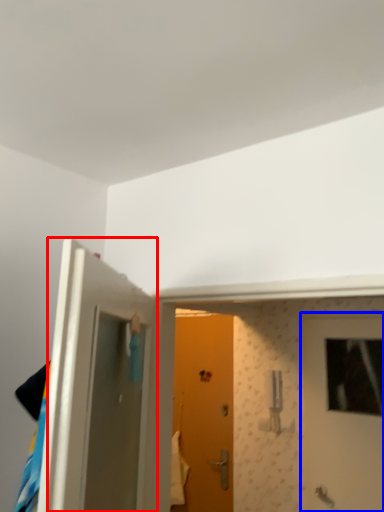
Question: Among these objects, which one is farthest to the camera, door (highlighted by a red box) or door (highlighted by a blue box)?

Choices:
 (A) door
 (B) door

Answer: (B)